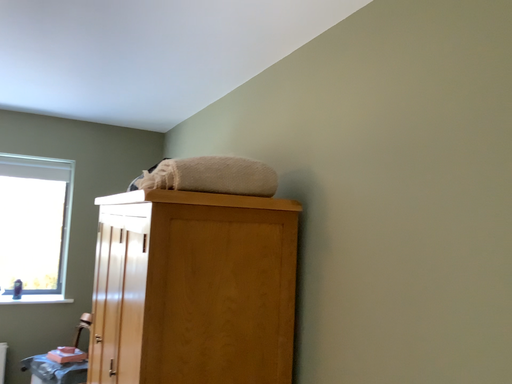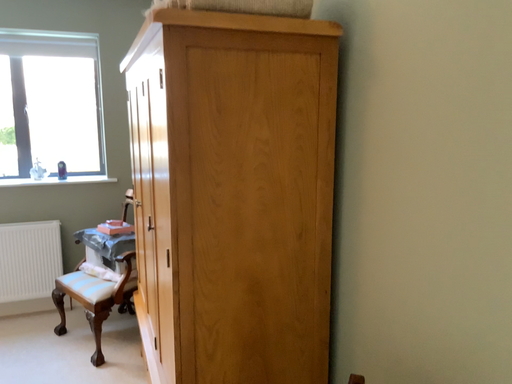
Question: How did the camera likely rotate when shooting the video?

Choices:
 (A) rotated upward
 (B) rotated downward

Answer: (B)